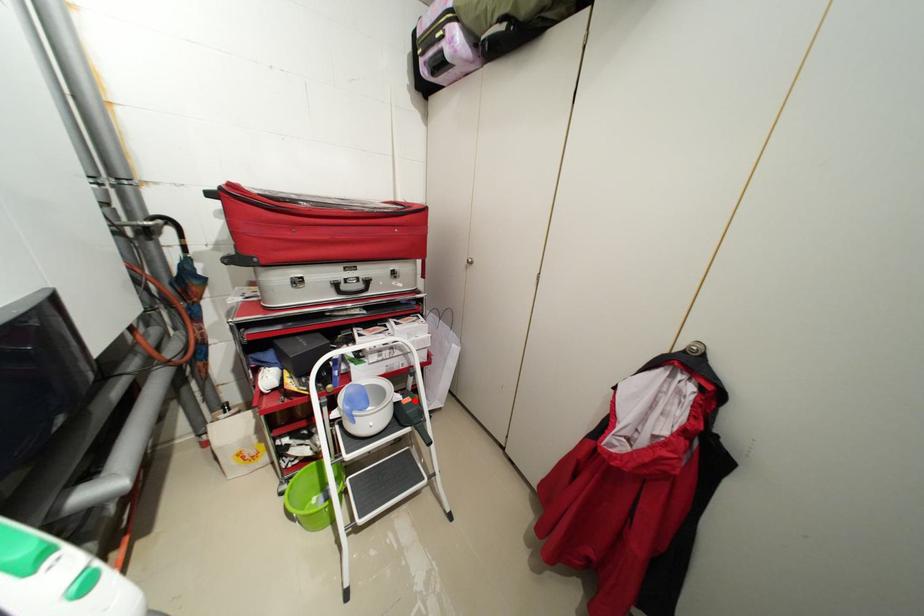
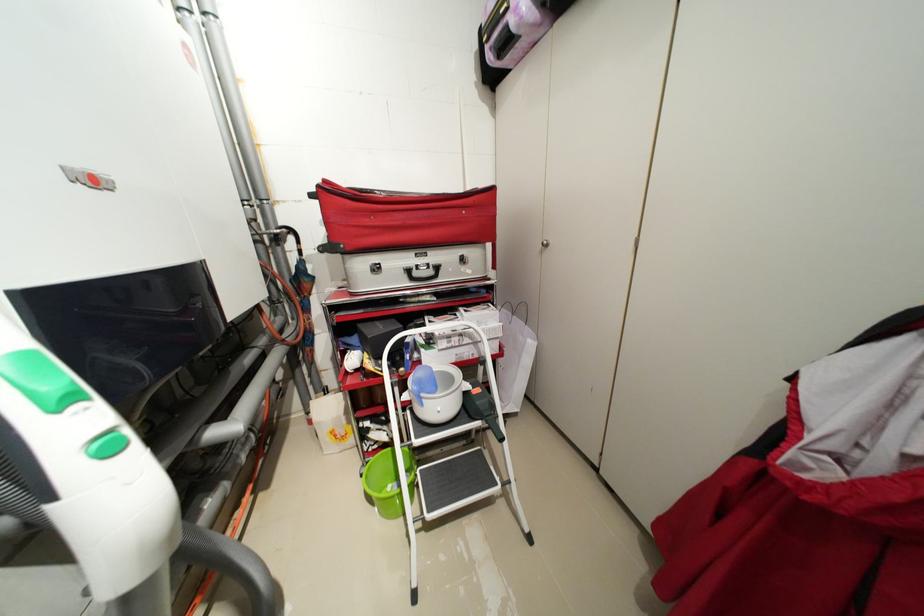
Question: I am providing you with two images of the same scene from different viewpoints. In image1, a red point is highlighted. Considering the same 3D point in image2, which of the following is correct?

Choices:
 (A) It is closer
 (B) It is farther

Answer: (B)